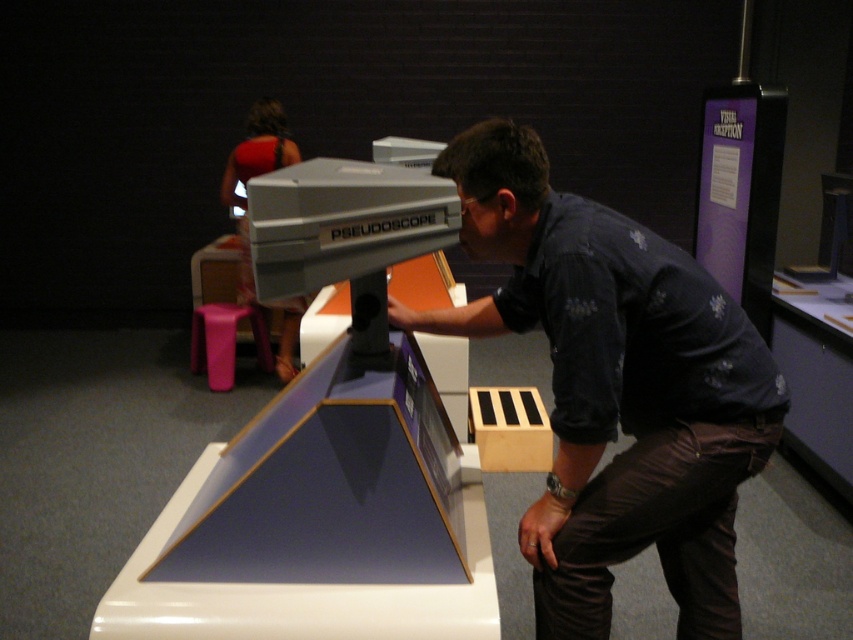
Question: Which object appears farthest from the camera in this image?

Choices:
 (A) dark blue shirt at center
 (B) purple plastic stool at lower left

Answer: (B)

Question: Which object is closer to the camera taking this photo?

Choices:
 (A) purple plastic stool at lower left
 (B) dark blue shirt at center

Answer: (B)

Question: Does dark blue shirt at center appear on the right side of purple plastic stool at lower left?

Choices:
 (A) no
 (B) yes

Answer: (B)

Question: Does dark blue shirt at center appear over purple plastic stool at lower left?

Choices:
 (A) no
 (B) yes

Answer: (A)

Question: Does dark blue shirt at center come behind purple plastic stool at lower left?

Choices:
 (A) yes
 (B) no

Answer: (B)